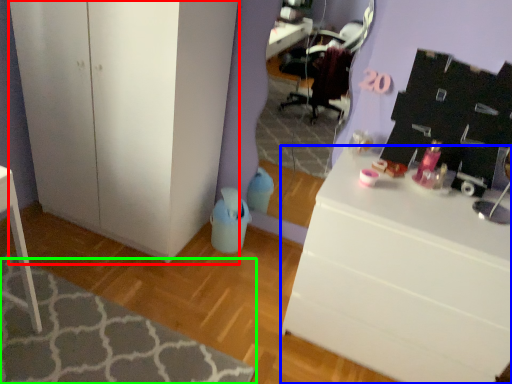
Question: Which object is positioned closest to cabinetry (highlighted by a red box)? Select from desk (highlighted by a blue box) and mat (highlighted by a green box).

Choices:
 (A) desk
 (B) mat

Answer: (B)